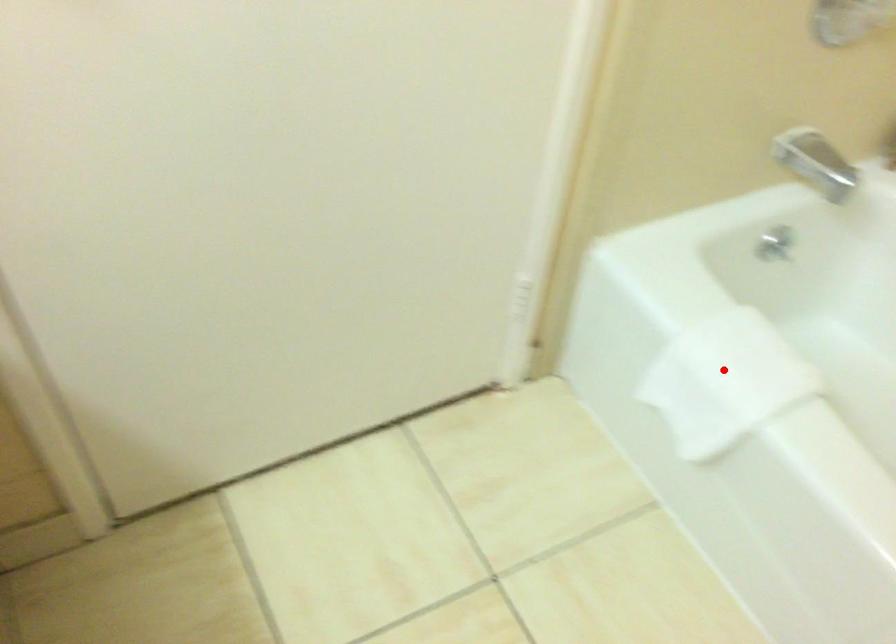
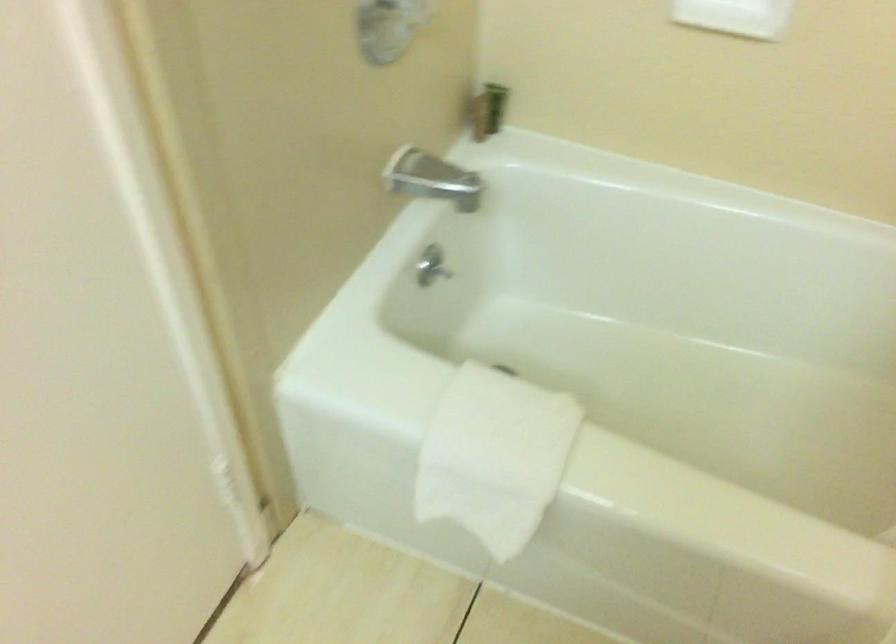
Question: I am providing you with two images of the same scene from different viewpoints. In image1, a red point is highlighted. Considering the same 3D point in image2, which of the following is correct?

Choices:
 (A) It is closer
 (B) It is farther

Answer: (A)